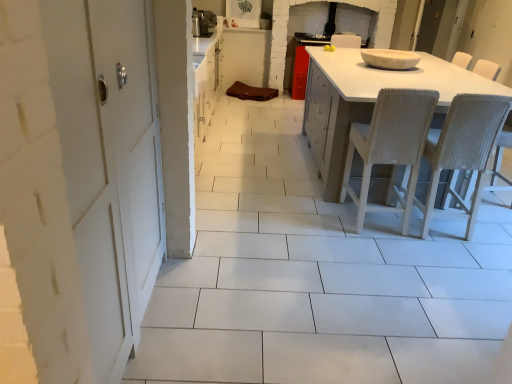
Question: Does white glossy bowl at center, the second appliance when ordered from back to front, appear on the right side of white matte table at right?

Choices:
 (A) yes
 (B) no

Answer: (B)

Question: From a real-world perspective, does white glossy bowl at center, the second appliance when ordered from back to front, stand above white matte table at right?

Choices:
 (A) no
 (B) yes

Answer: (B)

Question: Can you confirm if white glossy bowl at center, which ranks as the second appliance in top-to-bottom order, is bigger than white matte table at right?

Choices:
 (A) yes
 (B) no

Answer: (B)

Question: Are white glossy bowl at center, positioned as the 1th appliance in front-to-back order, and white matte table at right beside each other?

Choices:
 (A) no
 (B) yes

Answer: (A)

Question: Is white glossy bowl at center, which ranks as the second appliance in top-to-bottom order, aimed at white matte table at right?

Choices:
 (A) yes
 (B) no

Answer: (B)

Question: From the image's perspective, relative to brown fabric at center, is white glossy bowl at center, which ranks as the second appliance in top-to-bottom order, above or below?

Choices:
 (A) below
 (B) above

Answer: (A)

Question: Is white glossy bowl at center, which is the 2th appliance from left to right, inside the boundaries of brown fabric at center, or outside?

Choices:
 (A) outside
 (B) inside

Answer: (A)

Question: Visually, is white glossy bowl at center, positioned as the 1th appliance in front-to-back order, positioned to the left or to the right of brown fabric at center?

Choices:
 (A) left
 (B) right

Answer: (B)

Question: In terms of size, does white glossy bowl at center, the first appliance in the right-to-left sequence, appear bigger or smaller than brown fabric at center?

Choices:
 (A) big
 (B) small

Answer: (B)

Question: Is woven wood chair at center, the second chair viewed from the right, bigger or smaller than white matte table at right?

Choices:
 (A) big
 (B) small

Answer: (B)

Question: Does point (380, 155) appear closer or farther from the camera than point (418, 190)?

Choices:
 (A) closer
 (B) farther

Answer: (A)

Question: Looking at their shapes, would you say woven wood chair at center, the second chair viewed from the right, is wider or thinner than white matte table at right?

Choices:
 (A) thin
 (B) wide

Answer: (A)

Question: From a real-world perspective, relative to white matte table at right, is woven wood chair at center, which appears as the 1th chair when viewed from the left, vertically above or below?

Choices:
 (A) below
 (B) above

Answer: (B)

Question: In terms of size, does white matte table at right appear bigger or smaller than white woven chair at right, the first chair viewed from the right?

Choices:
 (A) big
 (B) small

Answer: (A)

Question: From a real-world perspective, is white matte table at right above or below white woven chair at right, the first chair viewed from the right?

Choices:
 (A) below
 (B) above

Answer: (A)